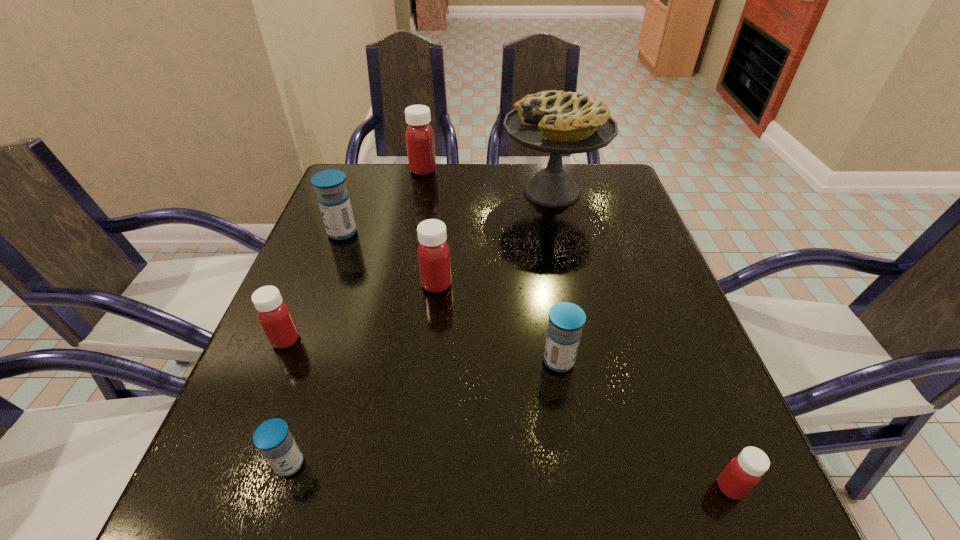
Image resolution: width=960 pixels, height=540 pixels. I want to click on the closest red medicine to the leftmost red medicine, so tap(433, 252).

Locate which blue medicine is the second closest to the third smallest red medicine. Please provide its 2D coordinates. Your answer should be formatted as a tuple, i.e. [(x, y)], where the tuple contains the x and y coordinates of a point satisfying the conditions above.

[(566, 320)]

I want to click on blue medicine identified as the second closest to the seventh shortest object, so click(566, 320).

Where is `vacant space that satisfies the following two spatial constraints: 1. on the front side of the second smallest blue medicine; 2. on the left side of the biggest red medicine`? vacant space that satisfies the following two spatial constraints: 1. on the front side of the second smallest blue medicine; 2. on the left side of the biggest red medicine is located at coordinates (388, 361).

Find the location of a particular element. vacant point that satisfies the following two spatial constraints: 1. on the back side of the rightmost object; 2. on the cut side of the pie is located at coordinates point(612,192).

At what (x,y) coordinates should I click in order to perform the action: click on free space that satisfies the following two spatial constraints: 1. on the front side of the third smallest red medicine; 2. on the right side of the biggest blue medicine. Please return your answer as a coordinate pair (x, y). The image size is (960, 540). Looking at the image, I should click on (323, 285).

At what (x,y) coordinates should I click in order to perform the action: click on vacant space that satisfies the following two spatial constraints: 1. on the cut side of the pie; 2. on the front side of the third red medicine from left to right. Please return your answer as a coordinate pair (x, y). Looking at the image, I should click on (572, 285).

The image size is (960, 540). In order to click on vacant space that satisfies the following two spatial constraints: 1. on the front side of the second nearest red medicine; 2. on the left side of the rightmost object in this screenshot , I will do `click(225, 488)`.